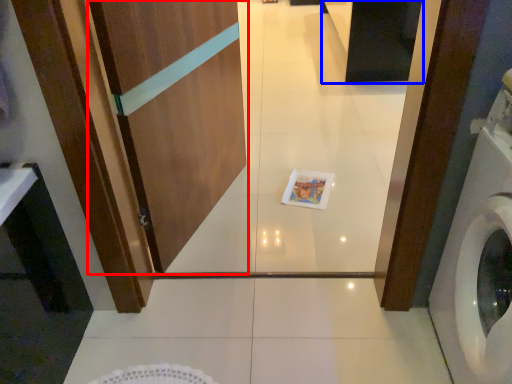
Question: Among these objects, which one is farthest to the camera, screen door (highlighted by a red box) or cabinetry (highlighted by a blue box)?

Choices:
 (A) screen door
 (B) cabinetry

Answer: (B)